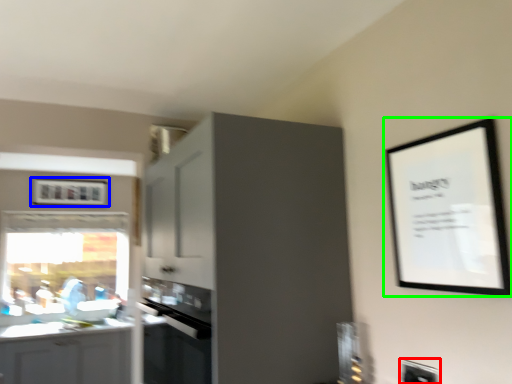
Question: Which object is positioned closest to electric outlet (highlighted by a red box)? Select from picture frame (highlighted by a blue box) and picture frame (highlighted by a green box).

Choices:
 (A) picture frame
 (B) picture frame

Answer: (B)